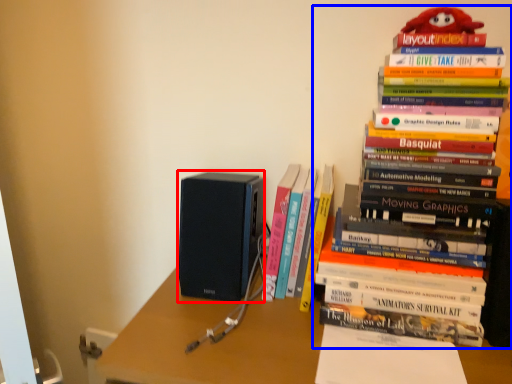
Question: Among these objects, which one is farthest to the camera, speaker (highlighted by a red box) or book (highlighted by a blue box)?

Choices:
 (A) speaker
 (B) book

Answer: (A)